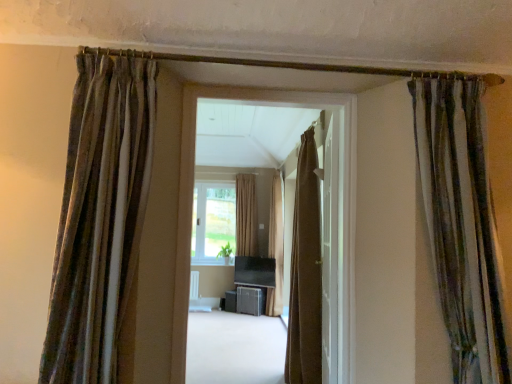
Question: Can you confirm if brown fabric curtain at center is positioned to the left of velvet striped curtain at upper left, placed as the 5th curtain when sorted from back to front?

Choices:
 (A) yes
 (B) no

Answer: (B)

Question: Is brown fabric curtain at center shorter than velvet striped curtain at upper left, acting as the fifth curtain starting from the right?

Choices:
 (A) no
 (B) yes

Answer: (A)

Question: Would you consider brown fabric curtain at center to be distant from velvet striped curtain at upper left, placed as the 5th curtain when sorted from back to front?

Choices:
 (A) no
 (B) yes

Answer: (A)

Question: Is brown fabric curtain at center turned away from velvet striped curtain at upper left, marked as the first curtain in a front-to-back arrangement?

Choices:
 (A) yes
 (B) no

Answer: (B)

Question: Is brown fabric curtain at center completely or partially outside of velvet striped curtain at upper left, marked as the first curtain in a front-to-back arrangement?

Choices:
 (A) no
 (B) yes

Answer: (B)

Question: From the image's perspective, does brown fabric curtain at center appear higher than velvet striped curtain at upper left, placed as the 5th curtain when sorted from back to front?

Choices:
 (A) yes
 (B) no

Answer: (B)

Question: Is brown textured curtain at center, the 3th curtain in the left-to-right sequence, outside of brown fabric curtain at center?

Choices:
 (A) yes
 (B) no

Answer: (A)

Question: Does brown textured curtain at center, placed as the second curtain when sorted from back to front, appear on the right side of brown fabric curtain at center?

Choices:
 (A) yes
 (B) no

Answer: (A)

Question: Is brown textured curtain at center, the 3th curtain in the left-to-right sequence, thinner than brown fabric curtain at center?

Choices:
 (A) yes
 (B) no

Answer: (B)

Question: Could you tell me if brown textured curtain at center, the third curtain viewed from the right, is facing brown fabric curtain at center?

Choices:
 (A) yes
 (B) no

Answer: (B)

Question: From a real-world perspective, does brown textured curtain at center, the third curtain viewed from the right, sit lower than brown fabric curtain at center?

Choices:
 (A) no
 (B) yes

Answer: (B)

Question: Does brown textured curtain at center, the third curtain viewed from the right, have a greater width compared to brown fabric curtain at center?

Choices:
 (A) no
 (B) yes

Answer: (B)

Question: Does velvet striped curtain at upper left, placed as the 5th curtain when sorted from back to front, have a greater height compared to brown textured curtain at center, acting as the third curtain starting from the front?

Choices:
 (A) yes
 (B) no

Answer: (B)